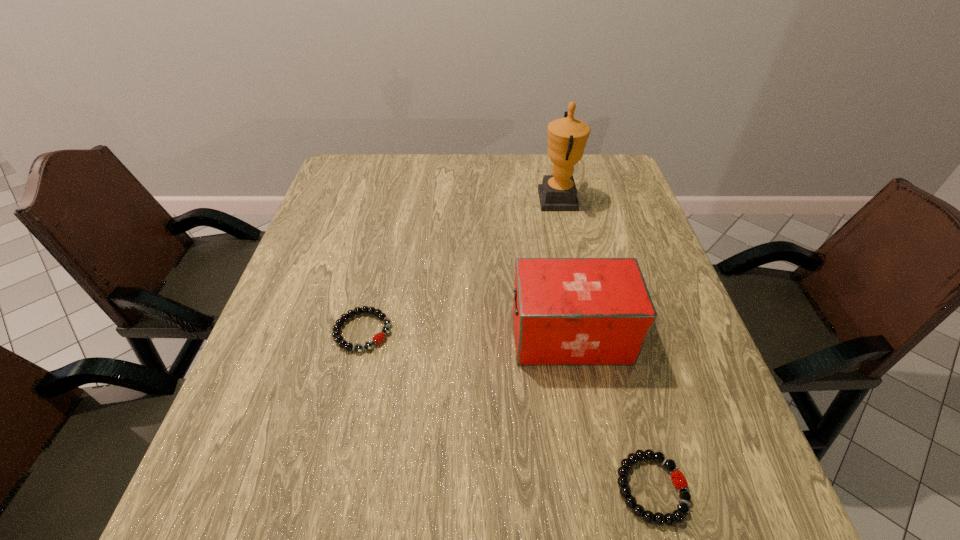
You are a GUI agent. You are given a task and a screenshot of the screen. Output one action in this format:
    pyautogui.click(x=<x>, y=<y>)
    Task: Click on the object that is positioned at the near right corner
    The height and width of the screenshot is (540, 960).
    Given the screenshot: What is the action you would take?
    pyautogui.click(x=678, y=479)

Identify the location of vacant region at the far edge. (x=440, y=171).

Identify the location of free space at the near edge. (635, 490).

You are a GUI agent. You are given a task and a screenshot of the screen. Output one action in this format:
    pyautogui.click(x=<x>, y=<y>)
    Task: Click on the vacant space at the left edge
    
    Given the screenshot: What is the action you would take?
    pyautogui.click(x=240, y=394)

Locate an element on the screen. free space at the right edge of the desktop is located at coordinates tap(595, 217).

The image size is (960, 540). In the image, there is a desktop. In order to click on vacant space at the near left corner in this screenshot , I will do `click(277, 517)`.

In the image, there is a desktop. At what (x,y) coordinates should I click in order to perform the action: click on vacant space at the far right corner. Please return your answer as a coordinate pair (x, y). Looking at the image, I should click on (583, 179).

Find the location of `vacant space at the near right corner of the desktop`. vacant space at the near right corner of the desktop is located at coordinates point(724,517).

At what (x,y) coordinates should I click in order to perform the action: click on vacant space in between the first-aid kit and the left bracelet. Please return your answer as a coordinate pair (x, y). Looking at the image, I should click on (467, 334).

Image resolution: width=960 pixels, height=540 pixels. Find the location of `free space between the right bracelet and the first-aid kit`. free space between the right bracelet and the first-aid kit is located at coordinates (612, 412).